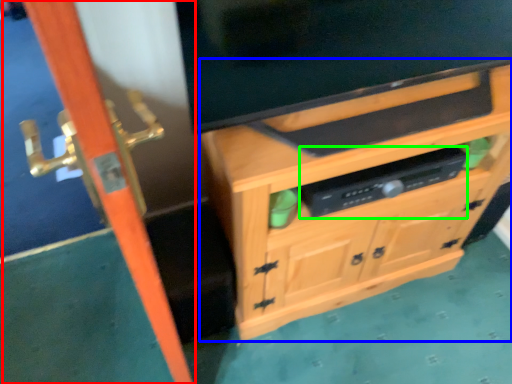
Question: Considering the real-world distances, which object is farthest from screen door (highlighted by a red box)? cabinetry (highlighted by a blue box) or appliance (highlighted by a green box)?

Choices:
 (A) cabinetry
 (B) appliance

Answer: (B)